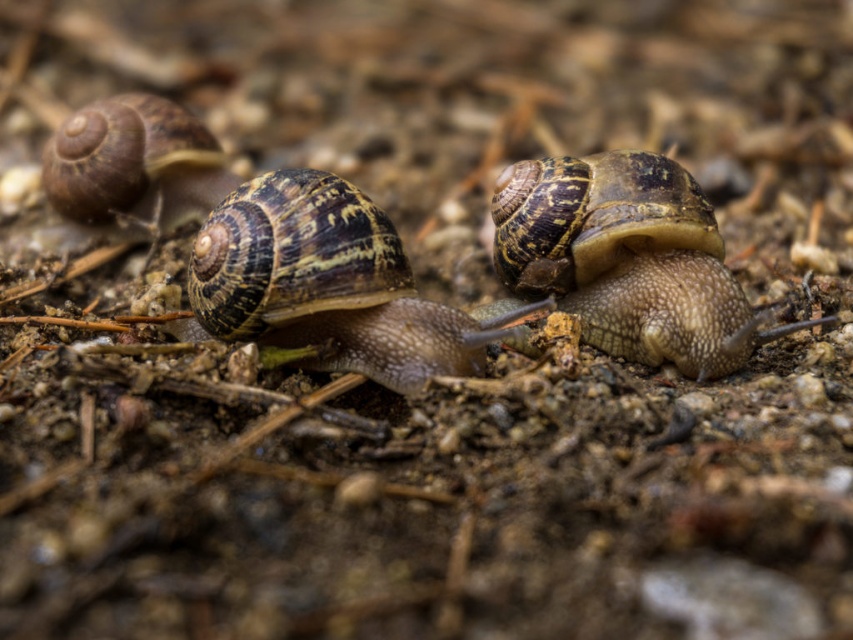
You are a gardener who wants to place a 20 inch ruler between the shiny brown shell at center and the shiny brown shell at left. Can the ruler fit between them without overlapping the shells?

The distance between the shiny brown shell at center and the shiny brown shell at left is 22.11 inches, which is longer than the 20 inch ruler. Therefore, the ruler can fit between them without overlapping the shells.

You are a biologist observing the snails. You notice the shiny brown snail at center and the shiny brown shell at left. Which one is bigger?

The shiny brown snail at center is larger in size compared to the shiny brown shell at left.

You are observing the snails and their shells in the image. Which object is located to the left of the other between the shiny brown snail at center and the shiny brown shell at left?

The shiny brown shell at left is located to the left of the shiny brown snail at center.